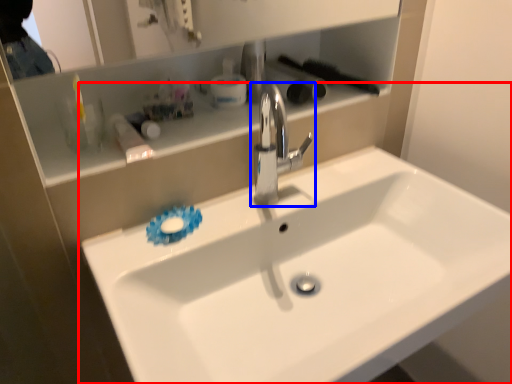
Question: Among these objects, which one is farthest to the camera, sink (highlighted by a red box) or tap (highlighted by a blue box)?

Choices:
 (A) sink
 (B) tap

Answer: (B)